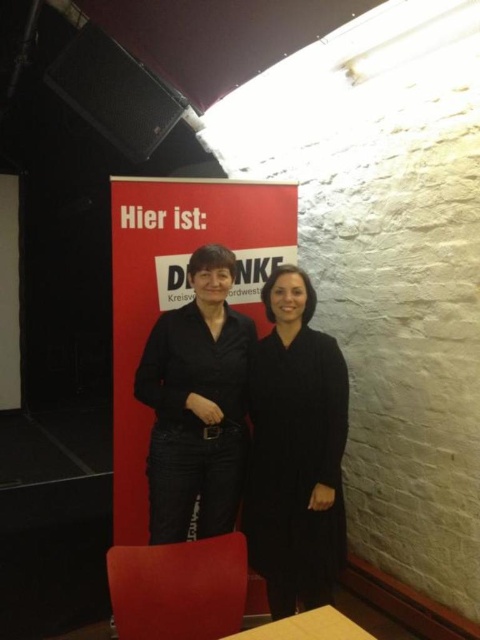
Does point (336, 365) come closer to viewer compared to point (251, 595)?

That is True.

Looking at this image, which is more to the right, black wool coat at center or red matte banner at center?

Positioned to the right is black wool coat at center.

Where is `black wool coat at center`? black wool coat at center is located at coordinates (296, 451).

Is black wool coat at center further to the viewer compared to yellow matte table at lower center?

Yes, it is.

Can you confirm if black wool coat at center is positioned to the right of yellow matte table at lower center?

Correct, you'll find black wool coat at center to the right of yellow matte table at lower center.

Where is `black wool coat at center`? The height and width of the screenshot is (640, 480). black wool coat at center is located at coordinates [x=296, y=451].

Can you confirm if black wool coat at center is positioned above black matte jacket at center?

Actually, black wool coat at center is below black matte jacket at center.

Which is below, black wool coat at center or black matte jacket at center?

black wool coat at center is lower down.

Is point (275, 612) positioned in front of point (240, 397)?

Yes, it is in front of point (240, 397).

Where is `black wool coat at center`? This screenshot has width=480, height=640. black wool coat at center is located at coordinates (296, 451).